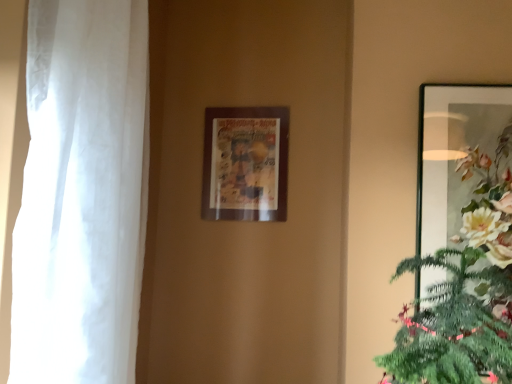
Measure the distance between point (450, 106) and camera.

Point (450, 106) is 3.84 feet away from camera.

You are a GUI agent. You are given a task and a screenshot of the screen. Output one action in this format:
    pyautogui.click(x=<x>, y=<y>)
    Task: Click on the metallic silver picture frame at right, which ranks as the 1th picture frame in front-to-back order
    
    Given the screenshot: What is the action you would take?
    pyautogui.click(x=466, y=172)

The width and height of the screenshot is (512, 384). What do you see at coordinates (82, 194) in the screenshot?
I see `white sheer curtain at left` at bounding box center [82, 194].

This screenshot has height=384, width=512. Find the location of `metallic silver picture frame at right, which ranks as the 1th picture frame in front-to-back order`. metallic silver picture frame at right, which ranks as the 1th picture frame in front-to-back order is located at coordinates (466, 172).

Is point (204, 196) farther from viewer compared to point (93, 292)?

Yes, it is.

From the image's perspective, which is below, wooden picture frame at center, which is the 2th picture frame from right to left, or white sheer curtain at left?

From the image's view, white sheer curtain at left is below.

Between wooden picture frame at center, which is the 2th picture frame from front to back, and white sheer curtain at left, which one is positioned behind?

wooden picture frame at center, which is the 2th picture frame from front to back, is further away from the camera.

Between wooden picture frame at center, positioned as the 1th picture frame in back-to-front order, and white sheer curtain at left, which one has smaller size?

wooden picture frame at center, positioned as the 1th picture frame in back-to-front order.

From a real-world perspective, is white sheer curtain at left physically located above or below metallic silver picture frame at right, which ranks as the 1th picture frame in front-to-back order?

From a real-world perspective, white sheer curtain at left is physically below metallic silver picture frame at right, which ranks as the 1th picture frame in front-to-back order.

Is white sheer curtain at left positioned with its back to metallic silver picture frame at right, the second picture frame from the back?

white sheer curtain at left does not have its back to metallic silver picture frame at right, the second picture frame from the back.

From the image's perspective, is white sheer curtain at left located above or below metallic silver picture frame at right, which is the first picture frame from right to left?

From the image's perspective, white sheer curtain at left appears below metallic silver picture frame at right, which is the first picture frame from right to left.

Does white sheer curtain at left have a greater height compared to metallic silver picture frame at right, which ranks as the 1th picture frame in front-to-back order?

Indeed, white sheer curtain at left has a greater height compared to metallic silver picture frame at right, which ranks as the 1th picture frame in front-to-back order.

Considering the sizes of metallic silver picture frame at right, which ranks as the 1th picture frame in front-to-back order, and white sheer curtain at left in the image, is metallic silver picture frame at right, which ranks as the 1th picture frame in front-to-back order, bigger or smaller than white sheer curtain at left?

In the image, metallic silver picture frame at right, which ranks as the 1th picture frame in front-to-back order, appears to be smaller than white sheer curtain at left.

Is metallic silver picture frame at right, which ranks as the 1th picture frame in front-to-back order, spatially inside white sheer curtain at left, or outside of it?

metallic silver picture frame at right, which ranks as the 1th picture frame in front-to-back order, is not inside white sheer curtain at left, it's outside.

Considering the relative positions of metallic silver picture frame at right, which ranks as the 1th picture frame in front-to-back order, and white sheer curtain at left in the image provided, is metallic silver picture frame at right, which ranks as the 1th picture frame in front-to-back order, to the left of white sheer curtain at left from the viewer's perspective?

In fact, metallic silver picture frame at right, which ranks as the 1th picture frame in front-to-back order, is to the right of white sheer curtain at left.

Between metallic silver picture frame at right, the second picture frame from the back, and white sheer curtain at left, which one has larger width?

white sheer curtain at left.

Based on the photo, who is shorter, metallic silver picture frame at right, which appears as the second picture frame when viewed from the left, or wooden picture frame at center, which is the 2th picture frame from right to left?

Standing shorter between the two is wooden picture frame at center, which is the 2th picture frame from right to left.

How much distance is there between metallic silver picture frame at right, which appears as the second picture frame when viewed from the left, and wooden picture frame at center, which is the 2th picture frame from right to left?

57.53 centimeters.

In the scene shown: How different are the orientations of metallic silver picture frame at right, which is the first picture frame from right to left, and wooden picture frame at center, the 1th picture frame when ordered from left to right, in degrees?

0.85 degrees.

Does metallic silver picture frame at right, which appears as the second picture frame when viewed from the left, have a larger size compared to wooden picture frame at center, which is the 2th picture frame from front to back?

Result: Yes, metallic silver picture frame at right, which appears as the second picture frame when viewed from the left, is bigger than wooden picture frame at center, which is the 2th picture frame from front to back.

From a real-world perspective, is wooden picture frame at center, the 1th picture frame when ordered from left to right, above or below metallic silver picture frame at right, which ranks as the 1th picture frame in front-to-back order?

From a real-world perspective, wooden picture frame at center, the 1th picture frame when ordered from left to right, is physically above metallic silver picture frame at right, which ranks as the 1th picture frame in front-to-back order.

Based on the photo, from the image's perspective, is wooden picture frame at center, positioned as the 1th picture frame in back-to-front order, located above metallic silver picture frame at right, which ranks as the 1th picture frame in front-to-back order?

Indeed, from the image's perspective, wooden picture frame at center, positioned as the 1th picture frame in back-to-front order, is shown above metallic silver picture frame at right, which ranks as the 1th picture frame in front-to-back order.

Is wooden picture frame at center, positioned as the 1th picture frame in back-to-front order, in front of or behind metallic silver picture frame at right, which appears as the second picture frame when viewed from the left, in the image?

wooden picture frame at center, positioned as the 1th picture frame in back-to-front order, is positioned farther from the viewer than metallic silver picture frame at right, which appears as the second picture frame when viewed from the left.

Which object is thinner, wooden picture frame at center, which is the 2th picture frame from front to back, or metallic silver picture frame at right, which is the first picture frame from right to left?

Thinner between the two is wooden picture frame at center, which is the 2th picture frame from front to back.

Which of these two, white sheer curtain at left or wooden picture frame at center, positioned as the 1th picture frame in back-to-front order, stands shorter?

wooden picture frame at center, positioned as the 1th picture frame in back-to-front order, is shorter.

Which object is wider, white sheer curtain at left or wooden picture frame at center, positioned as the 1th picture frame in back-to-front order?

Wider between the two is white sheer curtain at left.

From the image's perspective, is white sheer curtain at left positioned above or below wooden picture frame at center, which is the 2th picture frame from front to back?

Based on their image positions, white sheer curtain at left is located beneath wooden picture frame at center, which is the 2th picture frame from front to back.

How different are the orientations of white sheer curtain at left and wooden picture frame at center, the 1th picture frame when ordered from left to right, in degrees?

The facing directions of white sheer curtain at left and wooden picture frame at center, the 1th picture frame when ordered from left to right, are 90 degrees apart.

Locate an element on the screen. the 1st picture frame to the right when counting from the white sheer curtain at left is located at coordinates (245, 164).

Image resolution: width=512 pixels, height=384 pixels. Find the location of `the 1st picture frame behind the white sheer curtain at left, counting from the anchor's position`. the 1st picture frame behind the white sheer curtain at left, counting from the anchor's position is located at coordinates (466, 172).

From the image, which object appears to be nearer to metallic silver picture frame at right, which is the first picture frame from right to left, white sheer curtain at left or wooden picture frame at center, which is the 2th picture frame from right to left?

wooden picture frame at center, which is the 2th picture frame from right to left, lies closer to metallic silver picture frame at right, which is the first picture frame from right to left, than the other object.

Based on the photo, looking at the image, which one is located further to white sheer curtain at left, wooden picture frame at center, which is the 2th picture frame from front to back, or metallic silver picture frame at right, which appears as the second picture frame when viewed from the left?

metallic silver picture frame at right, which appears as the second picture frame when viewed from the left, lies further to white sheer curtain at left than the other object.

From the image, which object appears to be nearer to wooden picture frame at center, positioned as the 1th picture frame in back-to-front order, metallic silver picture frame at right, the second picture frame from the back, or white sheer curtain at left?

metallic silver picture frame at right, the second picture frame from the back, is closer to wooden picture frame at center, positioned as the 1th picture frame in back-to-front order.

Based on their spatial positions, is white sheer curtain at left or metallic silver picture frame at right, which ranks as the 1th picture frame in front-to-back order, further from wooden picture frame at center, the 1th picture frame when ordered from left to right?

Among the two, white sheer curtain at left is located further to wooden picture frame at center, the 1th picture frame when ordered from left to right.

Looking at the image, which one is located closer to white sheer curtain at left, metallic silver picture frame at right, which ranks as the 1th picture frame in front-to-back order, or wooden picture frame at center, which is the 2th picture frame from right to left?

wooden picture frame at center, which is the 2th picture frame from right to left, is positioned closer to the anchor white sheer curtain at left.

Considering their positions, is wooden picture frame at center, the 1th picture frame when ordered from left to right, positioned further to metallic silver picture frame at right, which is the first picture frame from right to left, than white sheer curtain at left?

white sheer curtain at left lies further to metallic silver picture frame at right, which is the first picture frame from right to left, than the other object.

This screenshot has height=384, width=512. In order to click on picture frame positioned between white sheer curtain at left and wooden picture frame at center, positioned as the 1th picture frame in back-to-front order, from near to far in this screenshot , I will do `click(466, 172)`.